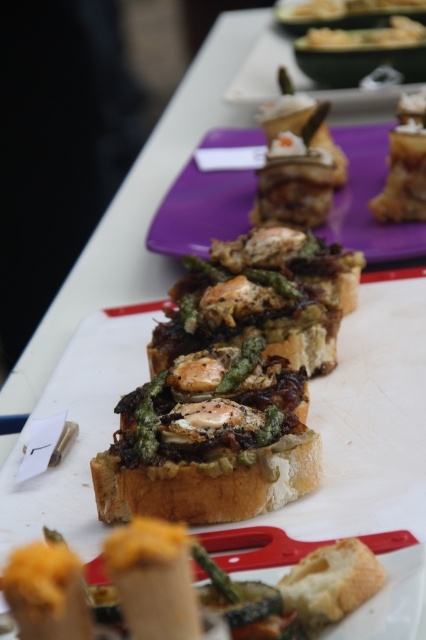
Who is positioned more to the right, golden brown bread at center or savory bread with asparagus and egg at upper right?

savory bread with asparagus and egg at upper right is more to the right.

Who is taller, golden brown bread at center or savory bread with asparagus and egg at upper right?

With more height is savory bread with asparagus and egg at upper right.

The height and width of the screenshot is (640, 426). Identify the location of golden brown bread at center. (293, 589).

Which is more to the left, matte purple plate at center or savory bread with asparagus and egg at upper right?

matte purple plate at center

Which is behind, point (374, 232) or point (402, 173)?

Positioned behind is point (374, 232).

Measure the distance between point (x=382, y=186) and camera.

A distance of 2.03 meters exists between point (x=382, y=186) and camera.

Find the location of a particular element. This screenshot has height=640, width=426. matte purple plate at center is located at coordinates (368, 200).

Can you confirm if golden brown bread at center is shorter than matte purple plate at center?

Yes, golden brown bread at center is shorter than matte purple plate at center.

How much distance is there between golden brown bread at center and matte purple plate at center?

A distance of 1.13 meters exists between golden brown bread at center and matte purple plate at center.

Locate an element on the screen. Image resolution: width=426 pixels, height=640 pixels. golden brown bread at center is located at coordinates (293, 589).